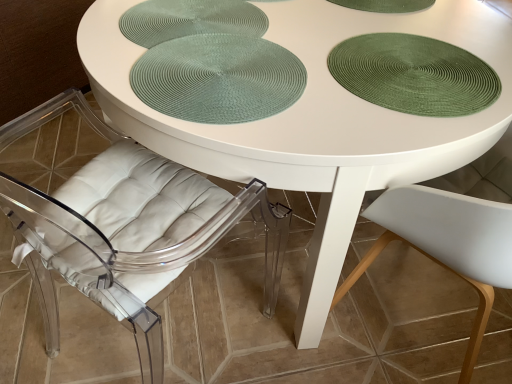
This screenshot has width=512, height=384. Identify the location of vacant space in front of green woven placemat at upper center, which ranks as the first glass plate in left-to-right order. tap(204, 87).